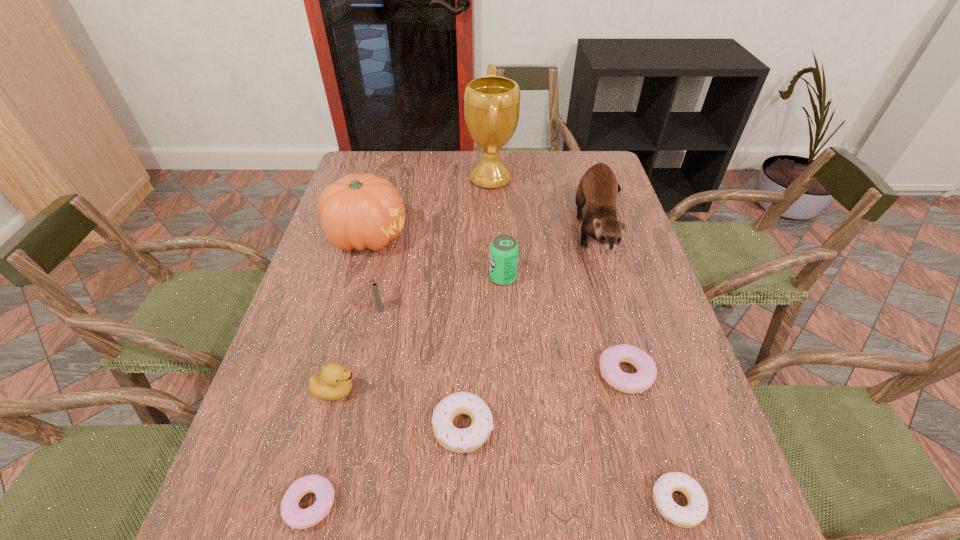
Identify the location of free region located 0.250m on the front-facing side of the pop soda. This screenshot has height=540, width=960. (396, 278).

Locate an element on the screen. free region located 0.310m on the front-facing side of the pop soda is located at coordinates (373, 278).

Where is `vacant position located on the back of the fifth farthest object`? vacant position located on the back of the fifth farthest object is located at coordinates (393, 245).

This screenshot has height=540, width=960. I want to click on blank area located on the face of the duckling, so click(x=415, y=390).

Locate an element on the screen. This screenshot has width=960, height=540. free space located 0.310m on the back of the third nearest doughnut is located at coordinates (467, 292).

Where is `vacant space located on the left of the farther pink doughnut`? The width and height of the screenshot is (960, 540). vacant space located on the left of the farther pink doughnut is located at coordinates (470, 374).

The height and width of the screenshot is (540, 960). I want to click on free point located 0.230m on the left of the right white doughnut, so click(522, 502).

Find the location of `vacant area situated on the back of the leftmost doughnut`. vacant area situated on the back of the leftmost doughnut is located at coordinates (358, 316).

The width and height of the screenshot is (960, 540). Identify the location of award that is at the far edge. (492, 103).

Find the location of a particular element. ferret that is at the far edge is located at coordinates (597, 190).